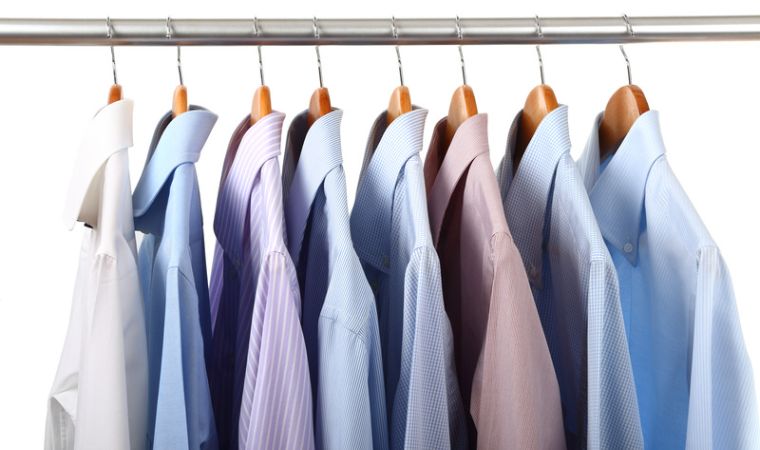
The width and height of the screenshot is (760, 450). What are the coordinates of `hook` in the screenshot? It's located at (109, 33), (171, 25), (257, 27), (312, 25), (388, 21), (458, 25), (537, 24), (625, 27).